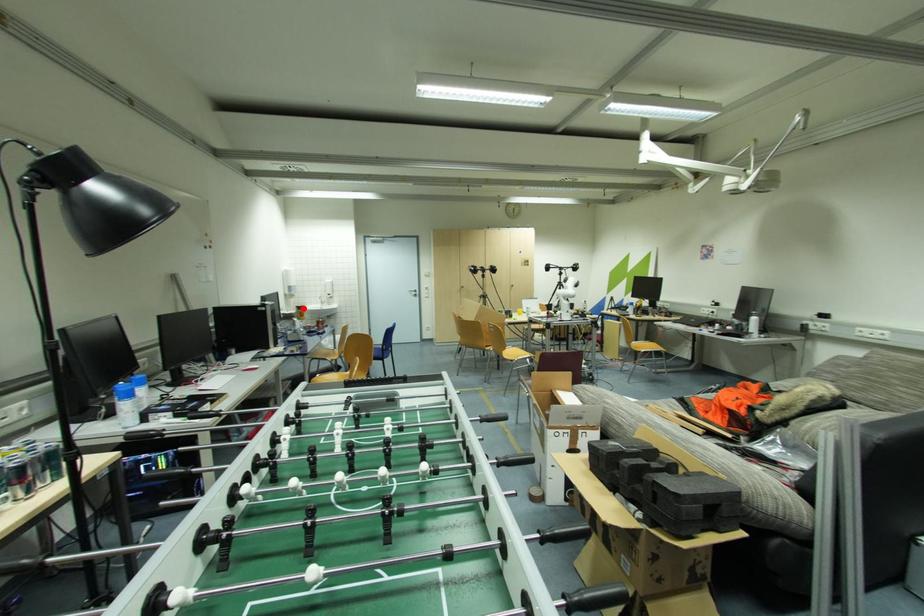
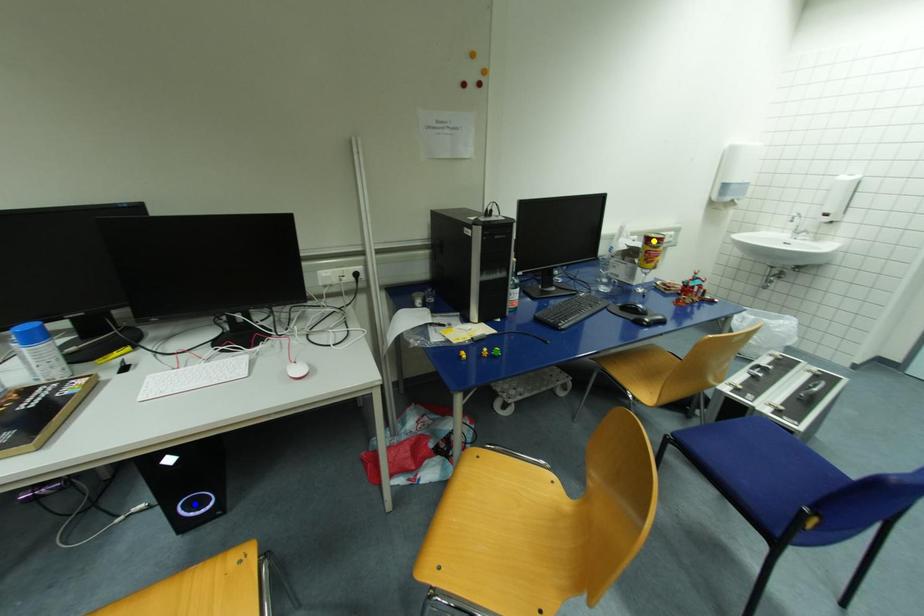
Question: I am providing you with two images of the same scene from different viewpoints. A red point is marked on the first image. You are given multiple points on the second image. In image 2, which mark is for the same physical point as the one in image 1?

Choices:
 (A) green point
 (B) blue point
 (C) yellow point

Answer: (C)